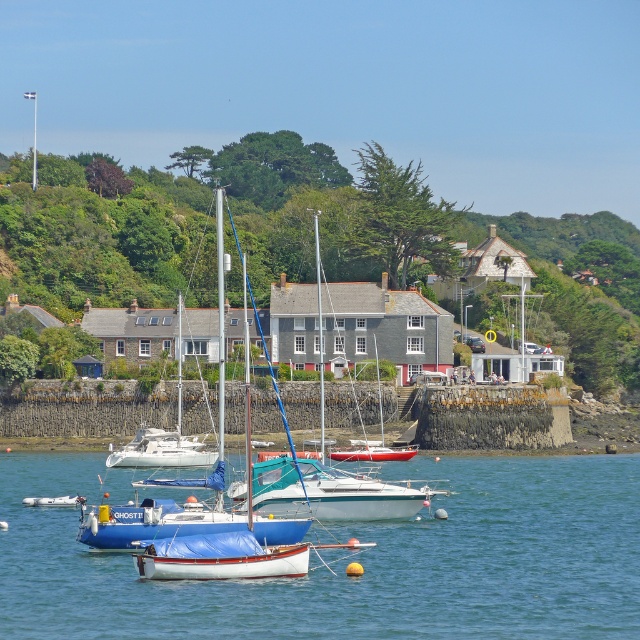
You are a marine biologist planning to anchor your research boat between the white matte sailboat at center and the blue matte sailboat at center. Given that your boat requires a space of 10 meters to maneuver safely, can you determine if there is enough space between them?

The white matte sailboat at center occupies less space than blue matte sailboat at center, but the exact distance between them isn

You are a photographer standing on the shore looking out at the scene. You notice the blue water at center and the white matte sailboat at center. Which object appears taller in the image?

The blue water at center appears taller than the white matte sailboat at center in the image.

You are a photographer planning to capture the entire scene in one shot. Given that the blue water at center and the white matte sailboat at center are both in your frame, which one will occupy more of the photo?

The blue water at center is bigger than the white matte sailboat at center, so it will occupy more space in the photo.